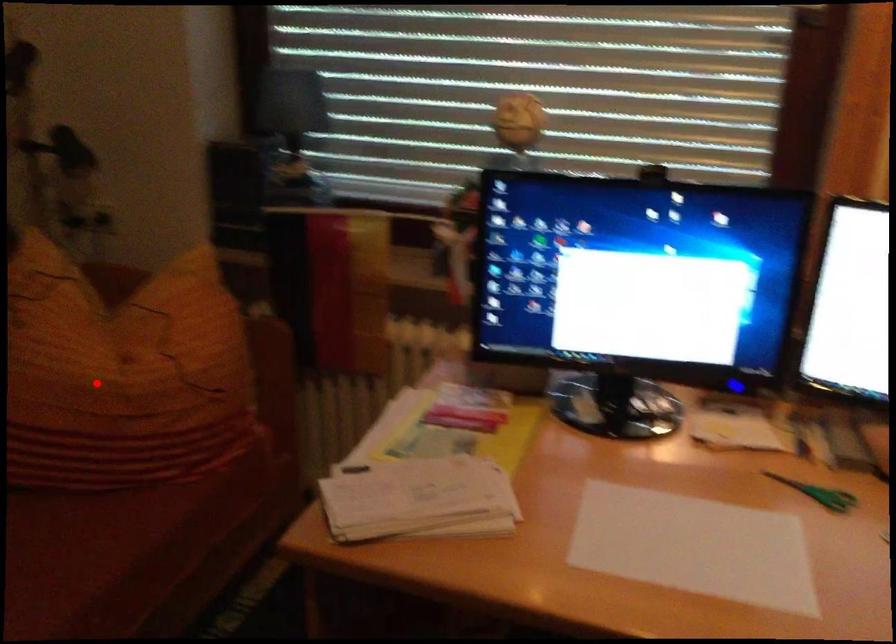
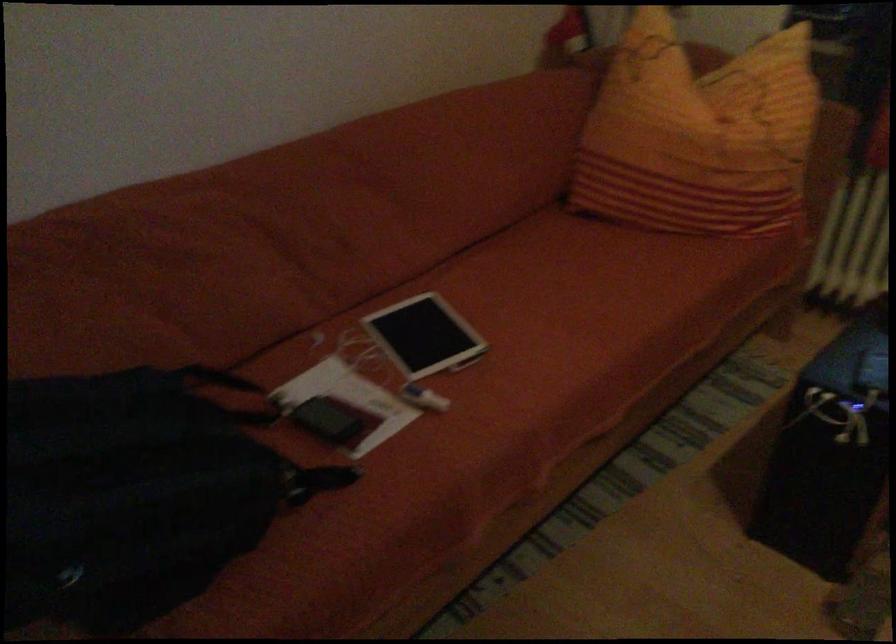
Find the pixel in the second image that matches the highlighted location in the first image.

(698, 135)